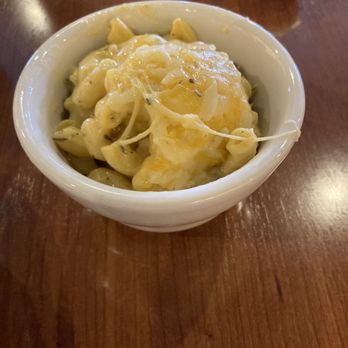
Identify the location of shadow from bowl. The height and width of the screenshot is (348, 348). (189, 262).